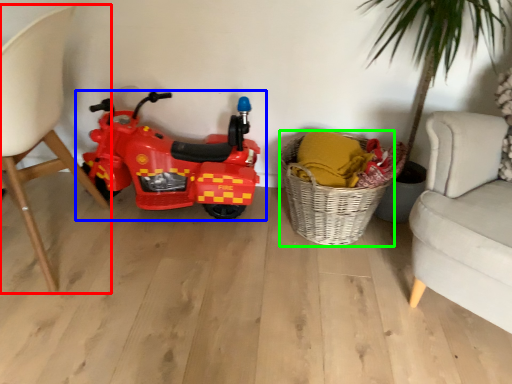
Question: Which is farther away from chair (highlighted by a red box)? land vehicle (highlighted by a blue box) or basket (highlighted by a green box)?

Choices:
 (A) land vehicle
 (B) basket

Answer: (B)